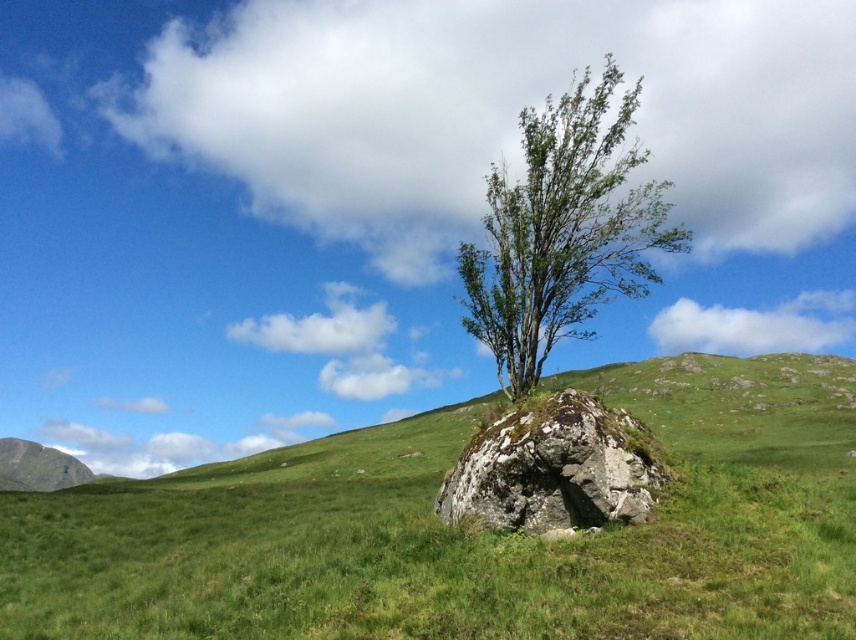
Question: Does green grass at center appear under green leafy tree at center?

Choices:
 (A) yes
 (B) no

Answer: (A)

Question: Which point is farther to the camera?

Choices:
 (A) mossy rock at center
 (B) green grass at center

Answer: (A)

Question: Which object is farther from the camera taking this photo?

Choices:
 (A) green leafy tree at center
 (B) green grass at center

Answer: (A)

Question: Is green grass at center bigger than green leafy tree at center?

Choices:
 (A) no
 (B) yes

Answer: (A)

Question: Estimate the real-world distances between objects in this image. Which object is farther from the green grass at center?

Choices:
 (A) green leafy tree at center
 (B) mossy rock at center

Answer: (A)

Question: Where is green grass at center located in relation to mossy rock at center in the image?

Choices:
 (A) right
 (B) left

Answer: (A)